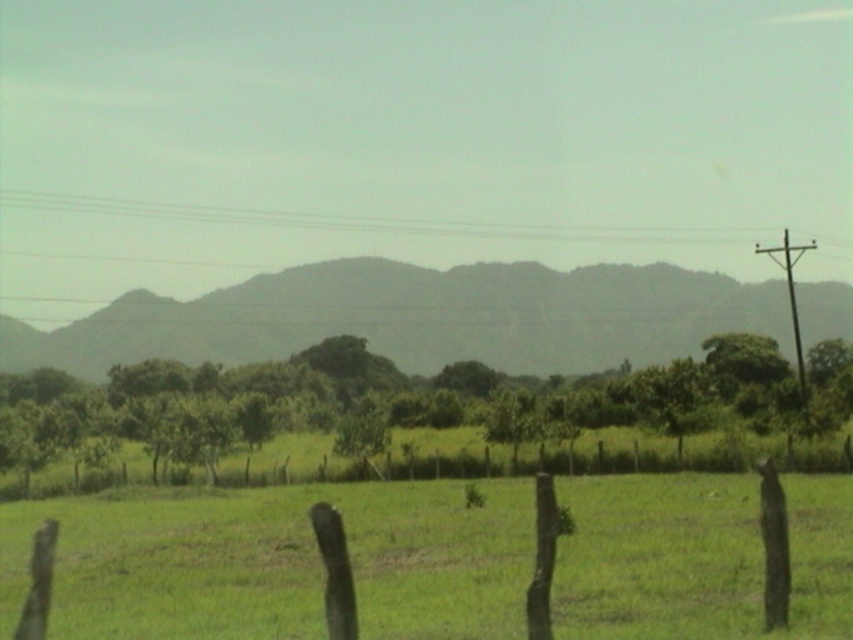
Question: Which point appears closest to the camera in this image?

Choices:
 (A) click(x=726, y=243)
 (B) click(x=187, y=468)

Answer: (B)

Question: Is green grassy field at center thinner than gray textured mountain at center?

Choices:
 (A) yes
 (B) no

Answer: (A)

Question: Can you confirm if green grassy field at center is positioned below green leafy tree at center?

Choices:
 (A) no
 (B) yes

Answer: (B)

Question: Which point appears closest to the camera in this image?

Choices:
 (A) (257, 440)
 (B) (614, 472)
 (C) (784, 244)

Answer: (B)

Question: Estimate the real-world distances between objects in this image. Which object is closer to the green grassy field at center?

Choices:
 (A) metallic pole at right
 (B) green leafy tree at center

Answer: (B)

Question: Is green wooden fence at lower center above metallic pole at right?

Choices:
 (A) yes
 (B) no

Answer: (B)